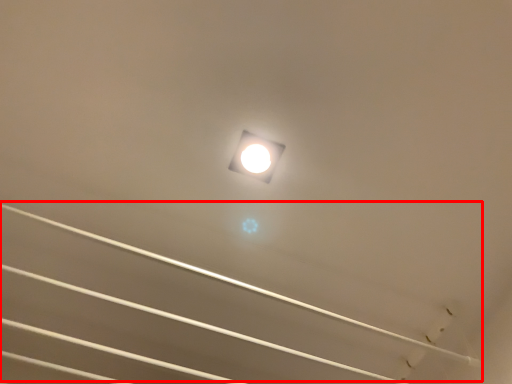
Question: From the image, what is the correct spatial relationship of line (annotated by the red box) in relation to lamp?

Choices:
 (A) left
 (B) right

Answer: (A)